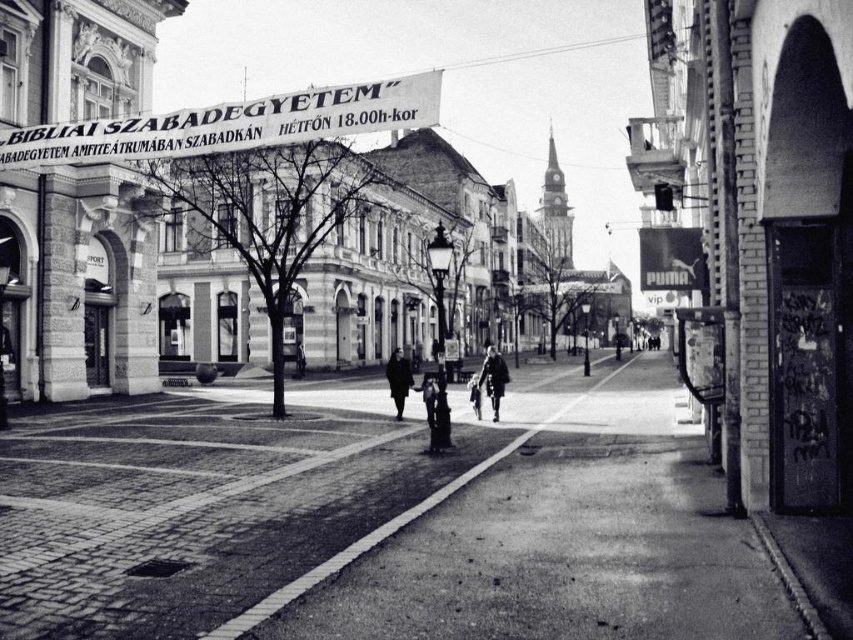
Question: Does dark gray coat at center have a lesser width compared to shiny chrome motorcycle at center?

Choices:
 (A) no
 (B) yes

Answer: (A)

Question: Considering the real-world distances, which object is farthest from the smooth black jacket at center?

Choices:
 (A) dark wool coat at center
 (B) dark gray coat at center
 (C) shiny chrome motorcycle at center

Answer: (B)

Question: Is dark gray coat at center smaller than shiny chrome motorcycle at center?

Choices:
 (A) yes
 (B) no

Answer: (B)

Question: Estimate the real-world distances between objects in this image. Which object is closer to the shiny chrome motorcycle at center?

Choices:
 (A) dark wool coat at center
 (B) dark gray coat at center
 (C) smooth black jacket at center

Answer: (B)

Question: Which object is farther from the camera taking this photo?

Choices:
 (A) dark gray coat at center
 (B) dark wool coat at center
 (C) shiny chrome motorcycle at center
 (D) smooth black jacket at center

Answer: (D)

Question: Does shiny chrome motorcycle at center appear on the right side of smooth black jacket at center?

Choices:
 (A) yes
 (B) no

Answer: (A)